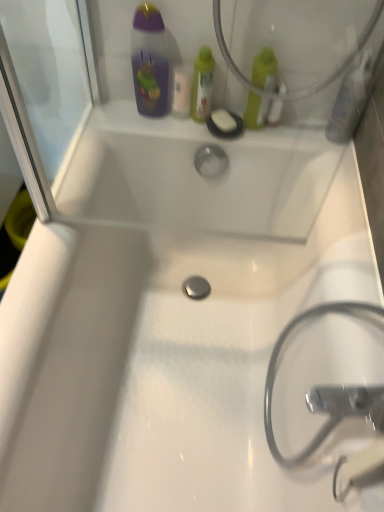
Where is `free spot to the right of white matte soap at upper center`? free spot to the right of white matte soap at upper center is located at coordinates (291, 131).